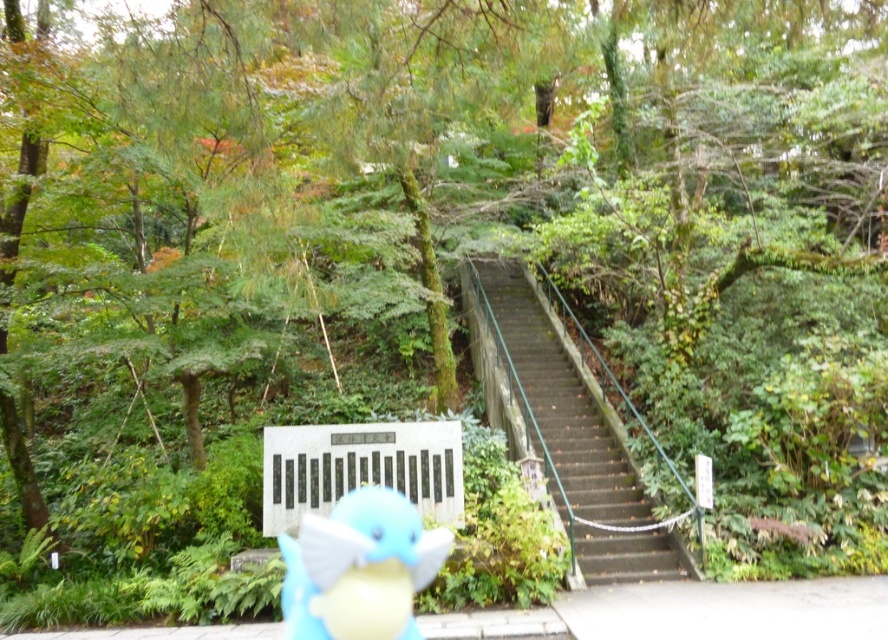
Question: Is dark gray concrete stairs at center closer to camera compared to blue plush toy at center?

Choices:
 (A) yes
 (B) no

Answer: (B)

Question: Among these points, which one is nearest to the camera?

Choices:
 (A) (576, 408)
 (B) (302, 532)

Answer: (B)

Question: Is dark gray concrete stairs at center wider than blue plush toy at center?

Choices:
 (A) no
 (B) yes

Answer: (B)

Question: Which point is closer to the camera?

Choices:
 (A) (292, 547)
 (B) (616, 470)

Answer: (A)

Question: Can you confirm if dark gray concrete stairs at center is wider than blue plush toy at center?

Choices:
 (A) no
 (B) yes

Answer: (B)

Question: Which of the following is the closest to the observer?

Choices:
 (A) blue plush toy at center
 (B) dark gray concrete stairs at center

Answer: (A)